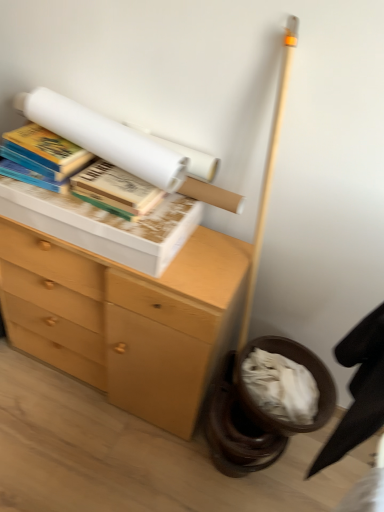
Question: From a real-world perspective, relative to hardcover book at upper left, which is counted as the third book, starting from the right, is black fabric swivel chair at lower right vertically above or below?

Choices:
 (A) above
 (B) below

Answer: (B)

Question: Would you say black fabric swivel chair at lower right is to the left or to the right of hardcover book at upper left, which ranks as the 1th book in left-to-right order, in the picture?

Choices:
 (A) left
 (B) right

Answer: (B)

Question: Which is farther from the hardcover book at upper left, which ranks as the 3th book in left-to-right order?

Choices:
 (A) black fabric swivel chair at lower right
 (B) hardcover book at upper left, which is counted as the third book, starting from the right
 (C) white paper at upper center, arranged as the 2th book when viewed from the left
 (D) wooden chest of drawers at left

Answer: (A)

Question: Considering the real-world distances, which object is closest to the wooden chest of drawers at left?

Choices:
 (A) hardcover book at upper left, which ranks as the 3th book in left-to-right order
 (B) black fabric swivel chair at lower right
 (C) white paper at upper center, arranged as the second book when viewed from the right
 (D) hardcover book at upper left, which ranks as the 1th book in left-to-right order

Answer: (A)